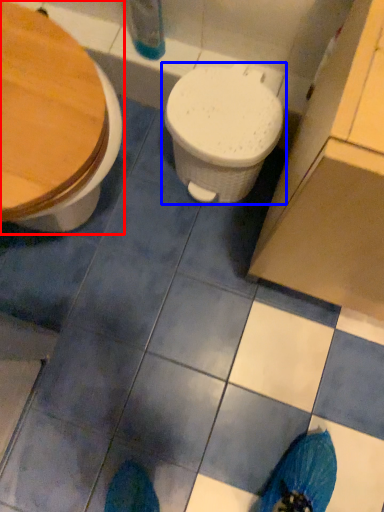
Question: Which object appears farthest to the camera in this image, toilet (highlighted by a red box) or toilet (highlighted by a blue box)?

Choices:
 (A) toilet
 (B) toilet

Answer: (B)